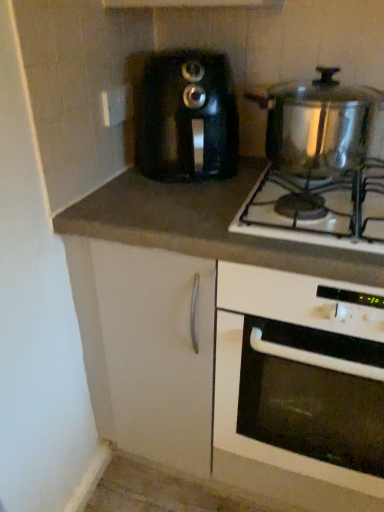
Question: Can you confirm if dark gray laminate countertop at center is bigger than shiny metallic pot at upper right?

Choices:
 (A) no
 (B) yes

Answer: (B)

Question: Does dark gray laminate countertop at center have a lesser width compared to shiny metallic pot at upper right?

Choices:
 (A) no
 (B) yes

Answer: (A)

Question: Is dark gray laminate countertop at center completely or partially outside of shiny metallic pot at upper right?

Choices:
 (A) yes
 (B) no

Answer: (A)

Question: Is dark gray laminate countertop at center behind shiny metallic pot at upper right?

Choices:
 (A) yes
 (B) no

Answer: (A)

Question: Is shiny metallic pot at upper right inside dark gray laminate countertop at center?

Choices:
 (A) no
 (B) yes

Answer: (A)

Question: Would you consider dark gray laminate countertop at center to be distant from shiny metallic pot at upper right?

Choices:
 (A) no
 (B) yes

Answer: (A)

Question: Is the depth of black plastic toaster at center greater than that of shiny metallic pot at upper right?

Choices:
 (A) no
 (B) yes

Answer: (B)

Question: Can you confirm if black plastic toaster at center is wider than shiny metallic pot at upper right?

Choices:
 (A) no
 (B) yes

Answer: (A)

Question: Can you confirm if black plastic toaster at center is bigger than shiny metallic pot at upper right?

Choices:
 (A) yes
 (B) no

Answer: (A)

Question: Can you confirm if black plastic toaster at center is smaller than shiny metallic pot at upper right?

Choices:
 (A) yes
 (B) no

Answer: (B)

Question: Is black plastic toaster at center located outside shiny metallic pot at upper right?

Choices:
 (A) yes
 (B) no

Answer: (A)

Question: Is black plastic toaster at center to the left of shiny metallic pot at upper right from the viewer's perspective?

Choices:
 (A) no
 (B) yes

Answer: (B)

Question: Is black plastic toaster at center to the left of dark gray laminate countertop at center from the viewer's perspective?

Choices:
 (A) yes
 (B) no

Answer: (B)